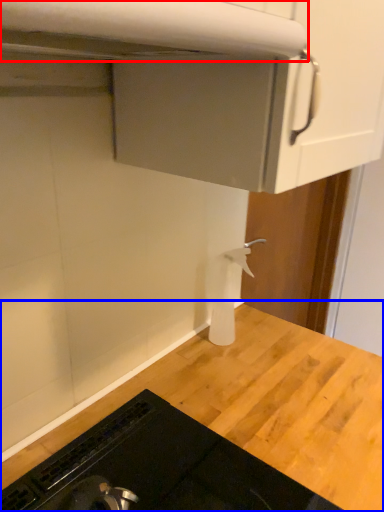
Question: Which object appears farthest to the camera in this image, exhaust hood (highlighted by a red box) or countertop (highlighted by a blue box)?

Choices:
 (A) exhaust hood
 (B) countertop

Answer: (B)